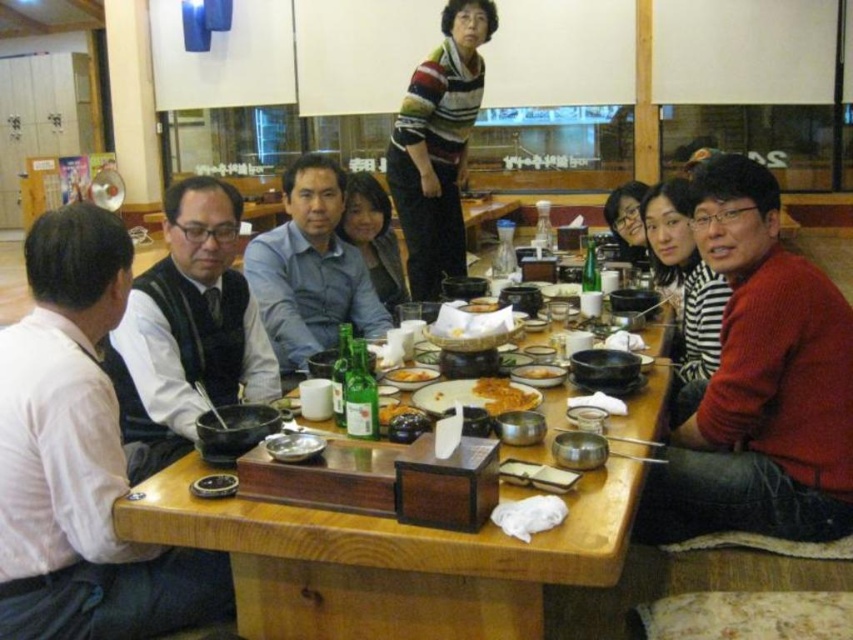
Question: Is matte black vest at left bigger than white glossy bowl at center?

Choices:
 (A) yes
 (B) no

Answer: (A)

Question: Among these objects, which one is farthest from the camera?

Choices:
 (A) smooth white rice bowl at center
 (B) striped sweater at right

Answer: (A)

Question: Where is matte black vest at left located in relation to yellow matte bowl at center in the image?

Choices:
 (A) below
 (B) above

Answer: (B)

Question: Can you confirm if striped sweater at right is smaller than matte gray shirt at center?

Choices:
 (A) yes
 (B) no

Answer: (B)

Question: Which point is closer to the camera?

Choices:
 (A) (677, 394)
 (B) (376, 208)

Answer: (A)

Question: Which point is farther to the camera?

Choices:
 (A) blue cotton shirt at center
 (B) smooth white rice bowl at center
 (C) matte black vest at left

Answer: (B)